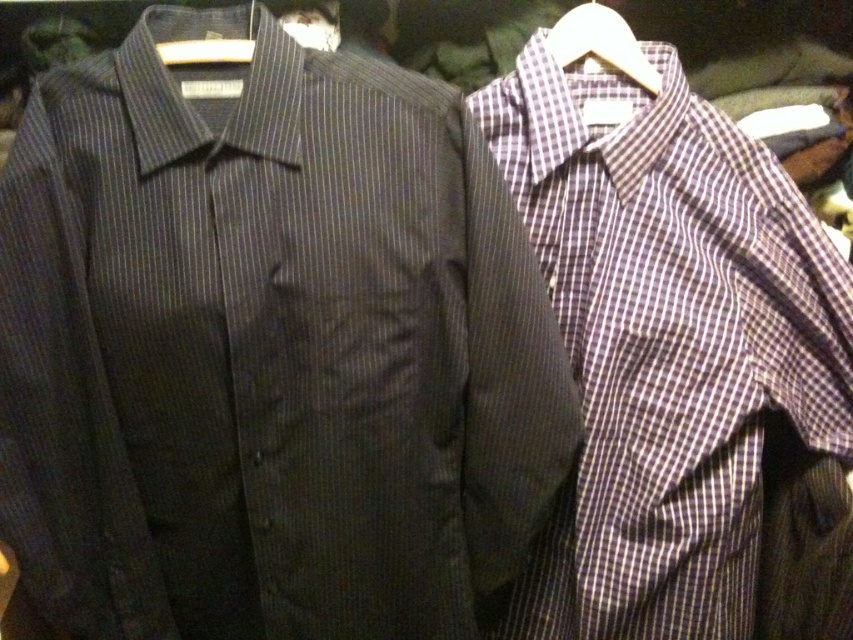
You are an assistant organizing a clothing store. You need to hang two shirts so that the one at point [759,460] is visible from the front. Where should you place the other shirt at point [164,52]?

Place the shirt at point [164,52] in front of the shirt at point [759,460] so that the latter remains visible from the front.

You are a store employee organizing shirts. You have a plaid cotton shirt at right and a white plastic hanger at upper right. Which item is taller?

The plaid cotton shirt at right is much taller than the white plastic hanger at upper right.